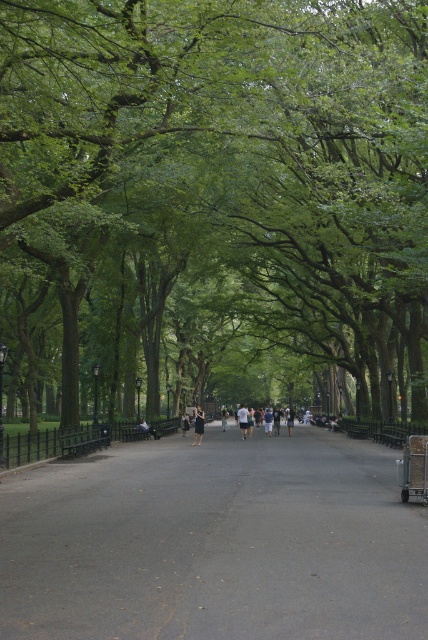
Is the position of dark asphalt road at center less distant than that of dark gray t-shirt at center?

That is True.

Is point (281, 566) farther from viewer compared to point (241, 424)?

No, it is in front of (241, 424).

Between point (329, 488) and point (238, 417), which one is positioned behind?

The point (238, 417) is more distant.

At what (x,y) coordinates should I click in order to perform the action: click on dark asphalt road at center. Please return your answer as a coordinate pair (x, y). This screenshot has height=640, width=428. Looking at the image, I should click on (214, 541).

Is green leafy tree at center thinner than black dress at center?

No.

Does green leafy tree at center have a smaller size compared to black dress at center?

No.

Between point (383, 6) and point (201, 419), which one is positioned behind?

The point (201, 419) is more distant.

At what (x,y) coordinates should I click in order to perform the action: click on green leafy tree at center. Please return your answer as a coordinate pair (x, y). Looking at the image, I should click on (214, 204).

Is black dress at center below dark gray t-shirt at center?

Incorrect, black dress at center is not positioned below dark gray t-shirt at center.

Which of these two, black dress at center or dark gray t-shirt at center, stands taller?

Standing taller between the two is dark gray t-shirt at center.

Between point (202, 426) and point (240, 428), which one is positioned in front?

Point (202, 426)

Locate an element on the screen. black dress at center is located at coordinates (199, 426).